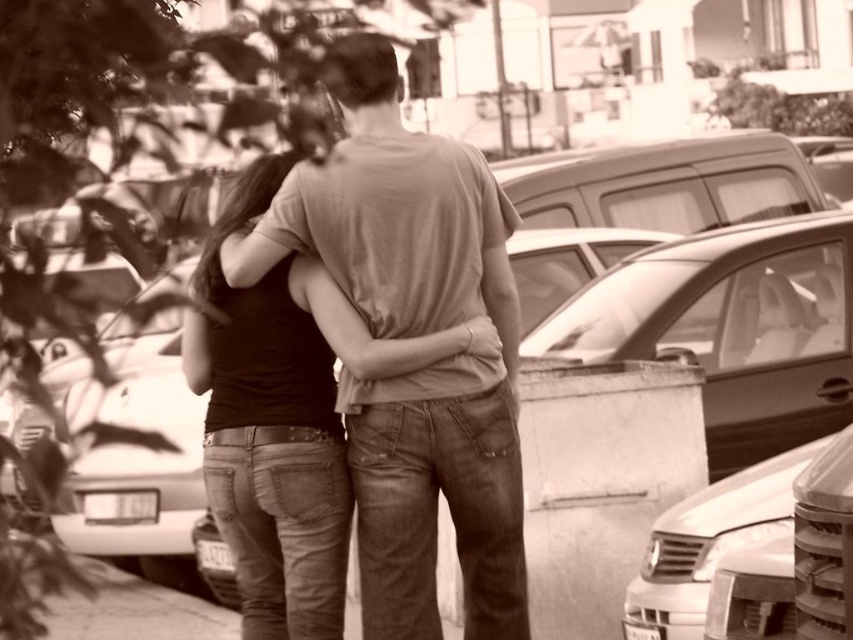
Can you confirm if matte brown shirt at center is positioned above metallic silver car at lower right?

Yes, matte brown shirt at center is above metallic silver car at lower right.

Does point (432, 289) lie in front of point (651, 616)?

That is True.

Where is `matte brown shirt at center`? The image size is (853, 640). matte brown shirt at center is located at coordinates (410, 333).

Between black matte tank top at center and metallic silver car at lower right, which one is positioned lower?

metallic silver car at lower right

Is black matte tank top at center further to camera compared to metallic silver car at lower right?

No, black matte tank top at center is in front of metallic silver car at lower right.

The height and width of the screenshot is (640, 853). What do you see at coordinates (271, 432) in the screenshot?
I see `black matte tank top at center` at bounding box center [271, 432].

Locate an element on the screen. black matte tank top at center is located at coordinates (271, 432).

Based on the photo, between matte brown shirt at center and black matte tank top at center, which one is positioned higher?

matte brown shirt at center is above.

Does point (409, 397) come closer to viewer compared to point (283, 339)?

That is True.

Is point (302, 173) less distant than point (287, 563)?

Yes, it is.

What are the coordinates of `matte brown shirt at center` in the screenshot? It's located at (410, 333).